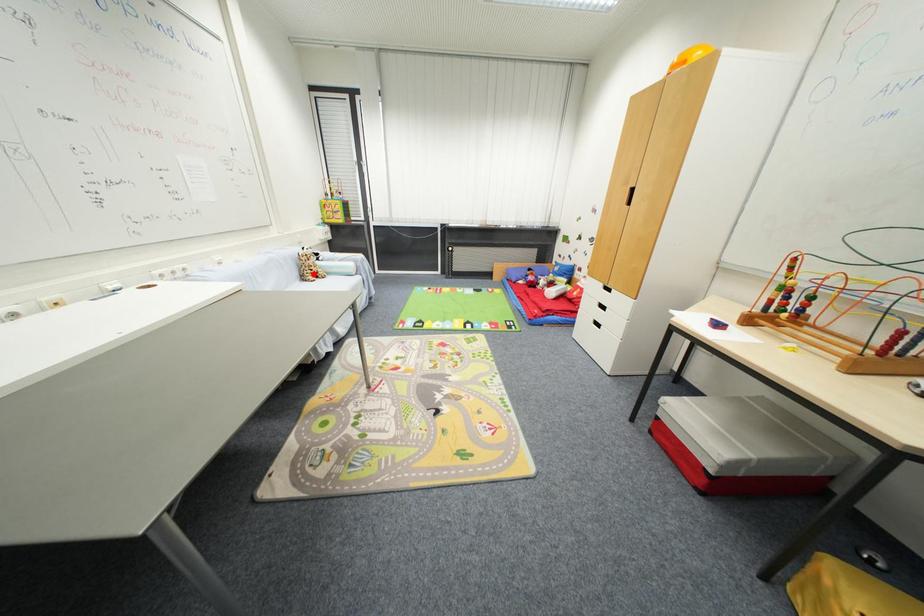
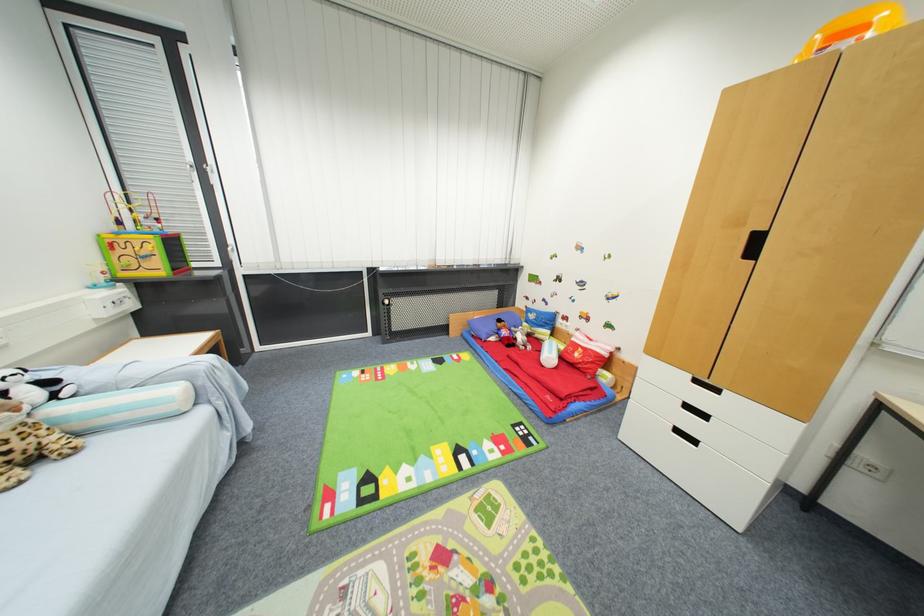
In the second image, find the point that corresponds to the highlighted location in the first image.

(7, 456)